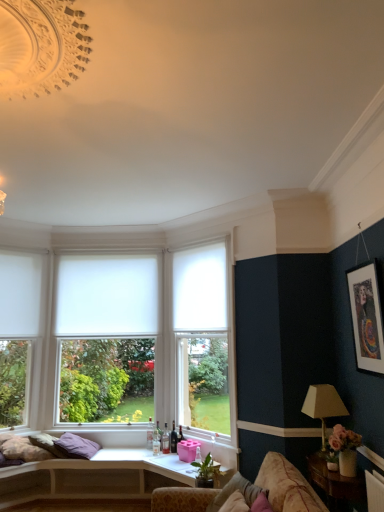
Find the location of a particular element. Image resolution: width=384 pixels, height=512 pixels. vacant space situated above white matte window at left, marked as the 3th window in a right-to-left arrangement (from a real-world perspective) is located at coordinates (18, 236).